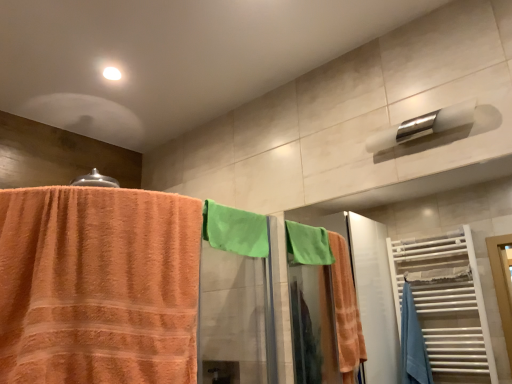
Question: Is orange terry cloth towel at left far from green terry cloth towel at center?

Choices:
 (A) no
 (B) yes

Answer: (A)

Question: Can you confirm if orange terry cloth towel at left is positioned to the left of green terry cloth towel at center?

Choices:
 (A) no
 (B) yes

Answer: (B)

Question: Considering the relative positions of orange terry cloth towel at left and green terry cloth towel at center in the image provided, is orange terry cloth towel at left to the right of green terry cloth towel at center from the viewer's perspective?

Choices:
 (A) no
 (B) yes

Answer: (A)

Question: Does orange terry cloth towel at left have a lesser height compared to green terry cloth towel at center?

Choices:
 (A) no
 (B) yes

Answer: (A)

Question: Can we say orange terry cloth towel at left lies outside green terry cloth towel at center?

Choices:
 (A) no
 (B) yes

Answer: (B)

Question: Is orange terry cloth towel at left next to green terry cloth towel at center?

Choices:
 (A) yes
 (B) no

Answer: (B)

Question: Considering the relative positions of orange terry cloth towel at left and white glossy towel bar at upper right in the image provided, is orange terry cloth towel at left to the right of white glossy towel bar at upper right from the viewer's perspective?

Choices:
 (A) no
 (B) yes

Answer: (A)

Question: Considering the relative sizes of orange terry cloth towel at left and white glossy towel bar at upper right in the image provided, is orange terry cloth towel at left wider than white glossy towel bar at upper right?

Choices:
 (A) yes
 (B) no

Answer: (A)

Question: Would you say orange terry cloth towel at left is a long distance from white glossy towel bar at upper right?

Choices:
 (A) yes
 (B) no

Answer: (B)

Question: Is orange terry cloth towel at left to the left of white glossy towel bar at upper right from the viewer's perspective?

Choices:
 (A) yes
 (B) no

Answer: (A)

Question: From a real-world perspective, is orange terry cloth towel at left positioned over white glossy towel bar at upper right based on gravity?

Choices:
 (A) yes
 (B) no

Answer: (B)

Question: Is orange terry cloth towel at left thinner than white glossy towel bar at upper right?

Choices:
 (A) yes
 (B) no

Answer: (B)

Question: Is white glossy towel bar at upper right at the right side of orange terry cloth towel at left?

Choices:
 (A) yes
 (B) no

Answer: (A)